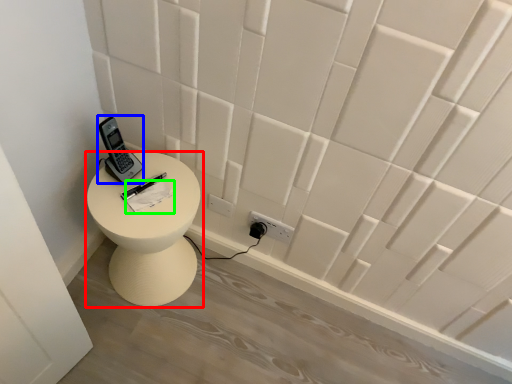
Question: Which object is positioned farthest from furniture (highlighted by a red box)? Select from control (highlighted by a blue box) and notepad (highlighted by a green box).

Choices:
 (A) control
 (B) notepad

Answer: (A)